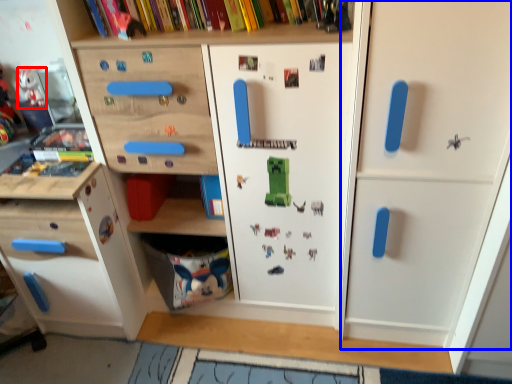
Question: Which object appears closest to the camera in this image, toy (highlighted by a red box) or door (highlighted by a blue box)?

Choices:
 (A) toy
 (B) door

Answer: (B)